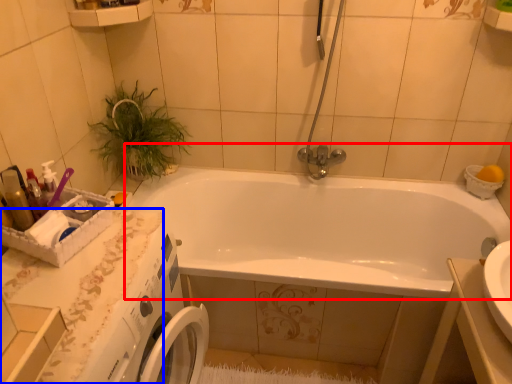
Question: Among these objects, which one is nearest to the camera, bathtub (highlighted by a red box) or counter top (highlighted by a blue box)?

Choices:
 (A) bathtub
 (B) counter top

Answer: (B)